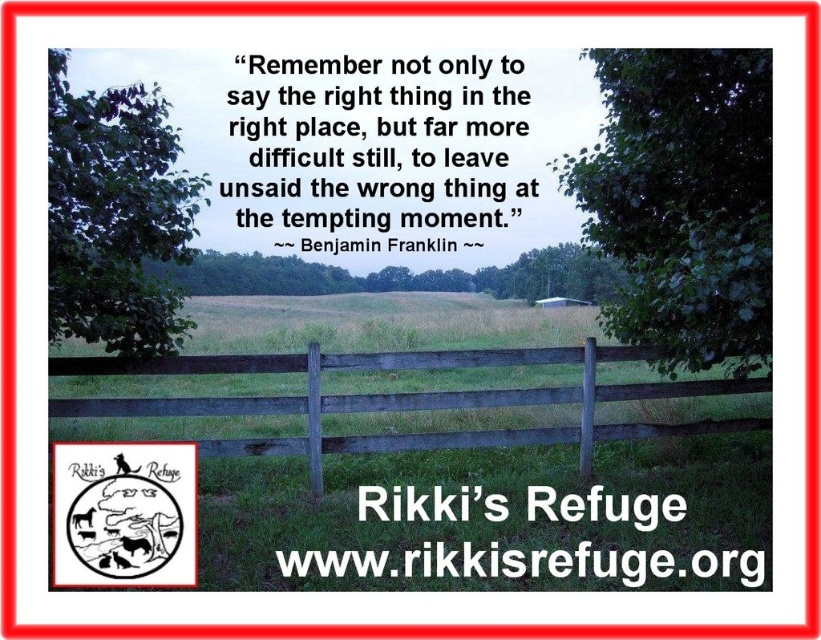
You are standing in the middle of the wooden fence in the rural landscape scene. You notice two points marked on the fence. The first point is at coordinates point (x=668, y=241) and the second is at point (x=354, y=408). Which of these two points is physically closer to your current position?

Point (x=668, y=241) is closer to the camera than point (x=354, y=408), so the first point is closer to your current position.

You are standing in the rural landscape and want to take a photo of the green leafy tree at upper left and the weathered wood fence at center. Which object will appear larger in your photo?

The green leafy tree at upper left will appear larger in the photo because it is positioned in front of the weathered wood fence at center, making it closer to the camera and thus larger in the frame.

You are a painter setting up your easel to capture the rural landscape. You want to paint the green leafy tree at upper right and the weathered wood fence at center. Which object should you focus on first if you want to paint the one that is closer to the foreground?

The weathered wood fence at center is closer to the foreground than the green leafy tree at upper right, so you should focus on painting the weathered wood fence at center first.